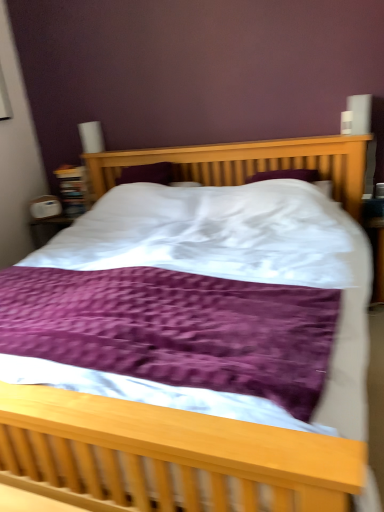
The image size is (384, 512). What do you see at coordinates (182, 455) in the screenshot?
I see `purple satin bed at center` at bounding box center [182, 455].

Where is `purple satin bed at center`? The width and height of the screenshot is (384, 512). purple satin bed at center is located at coordinates (182, 455).

Find the location of a particular element. The width and height of the screenshot is (384, 512). purple satin bed at center is located at coordinates (182, 455).